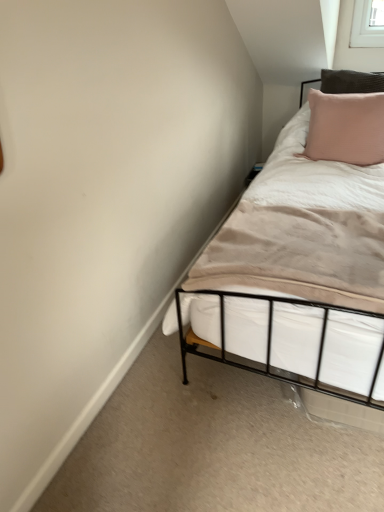
Question: Considering the positions of white soft fabric mattress at center and pink textured pillow at upper right in the image, is white soft fabric mattress at center wider or thinner than pink textured pillow at upper right?

Choices:
 (A) thin
 (B) wide

Answer: (B)

Question: Is white soft fabric mattress at center spatially inside pink textured pillow at upper right, or outside of it?

Choices:
 (A) outside
 (B) inside

Answer: (A)

Question: From their relative heights in the image, would you say white soft fabric mattress at center is taller or shorter than pink textured pillow at upper right?

Choices:
 (A) short
 (B) tall

Answer: (A)

Question: From a real-world perspective, is pink textured pillow at upper right physically located above or below white soft fabric mattress at center?

Choices:
 (A) below
 (B) above

Answer: (B)

Question: Is pink textured pillow at upper right taller or shorter than white soft fabric mattress at center?

Choices:
 (A) tall
 (B) short

Answer: (A)

Question: From the image's perspective, relative to white soft fabric mattress at center, is pink textured pillow at upper right above or below?

Choices:
 (A) above
 (B) below

Answer: (A)

Question: Is pink textured pillow at upper right in front of or behind white soft fabric mattress at center in the image?

Choices:
 (A) front
 (B) behind

Answer: (B)